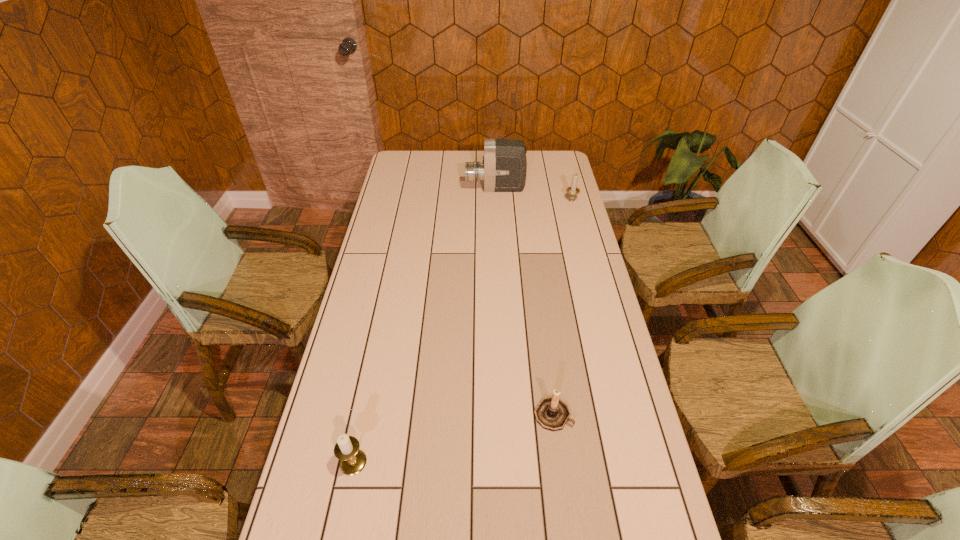
Find the location of a particular element. This screenshot has height=540, width=960. vacant area between the camcorder and the nearest object is located at coordinates (424, 326).

The image size is (960, 540). I want to click on empty space that is in between the farthest candle holder and the second candle holder from left to right, so click(x=563, y=307).

Locate which object is the closest to the tallest object. Please provide its 2D coordinates. Your answer should be formatted as a tuple, i.e. [(x, y)], where the tuple contains the x and y coordinates of a point satisfying the conditions above.

[(572, 191)]

Locate an element on the screen. the closest object to the rightmost object is located at coordinates (504, 167).

Locate an element on the screen. the second closest candle holder relative to the leftmost candle holder is located at coordinates (572, 191).

Identify which candle holder is the third nearest to the camcorder. Please provide its 2D coordinates. Your answer should be formatted as a tuple, i.e. [(x, y)], where the tuple contains the x and y coordinates of a point satisfying the conditions above.

[(352, 460)]

Image resolution: width=960 pixels, height=540 pixels. Find the location of `free spot that satisfies the following two spatial constraints: 1. at the front of the tallest object, highlighting the lens; 2. on the handle side of the farthest candle holder`. free spot that satisfies the following two spatial constraints: 1. at the front of the tallest object, highlighting the lens; 2. on the handle side of the farthest candle holder is located at coordinates (496, 200).

Where is `free space that satisfies the following two spatial constraints: 1. at the front of the tallest object, highlighting the lens; 2. on the handle side of the farthest candle holder`? The width and height of the screenshot is (960, 540). free space that satisfies the following two spatial constraints: 1. at the front of the tallest object, highlighting the lens; 2. on the handle side of the farthest candle holder is located at coordinates (496, 200).

Identify the location of vacant space that satisfies the following two spatial constraints: 1. at the front of the tallest object, highlighting the lens; 2. on the left side of the second nearest candle holder. (506, 414).

The width and height of the screenshot is (960, 540). What are the coordinates of `blank space that satisfies the following two spatial constraints: 1. on the handle side of the rightmost object; 2. at the front of the tallest object, highlighting the lens` in the screenshot? It's located at (568, 188).